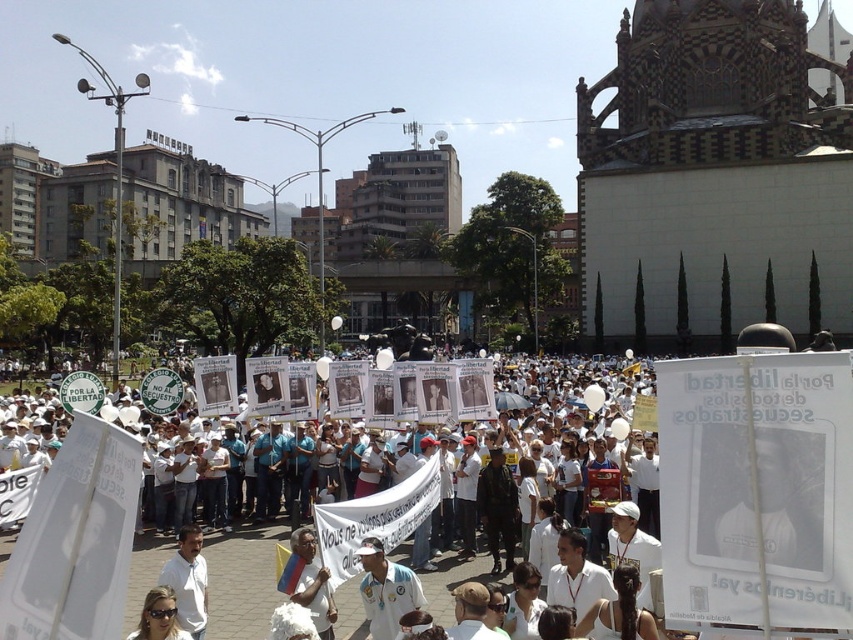
Question: Is white paper sign at center further to the viewer compared to white fabric shirt at center?

Choices:
 (A) yes
 (B) no

Answer: (B)

Question: Does white paper sign at center appear on the left side of white fabric shirt at center?

Choices:
 (A) no
 (B) yes

Answer: (B)

Question: Among these objects, which one is nearest to the camera?

Choices:
 (A) white paper sign at center
 (B) white shirt at center
 (C) white fabric shirt at center

Answer: (A)

Question: Which point is farther from the camera taking this photo?

Choices:
 (A) (318, 616)
 (B) (614, 474)

Answer: (B)

Question: Which of these objects is positioned farthest from the white paper sign at center?

Choices:
 (A) white shirt at center
 (B) white fabric shirt at center

Answer: (A)

Question: Observing the image, what is the correct spatial positioning of white paper sign at center in reference to white shirt at center?

Choices:
 (A) right
 (B) left

Answer: (B)